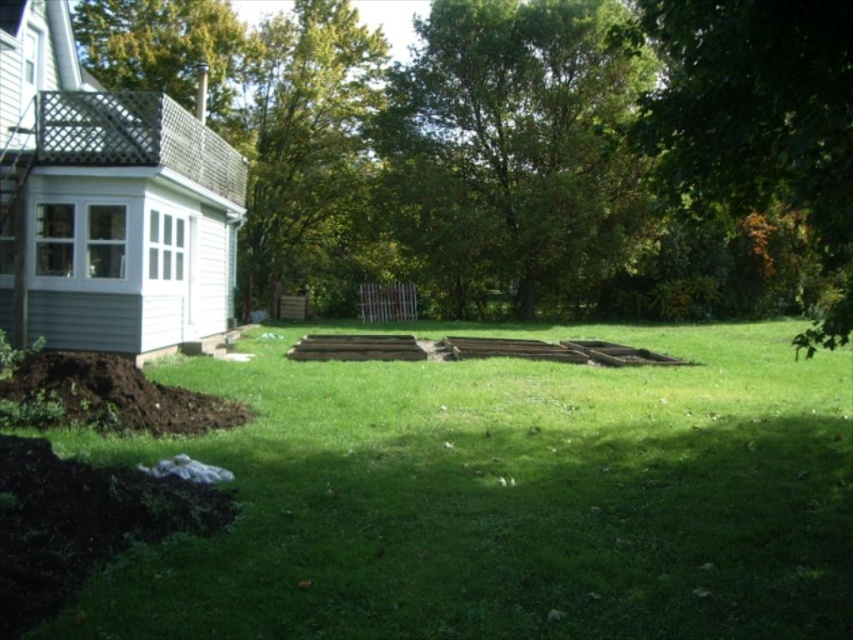
Question: Does green grass at center appear on the left side of green leafy tree at center?

Choices:
 (A) no
 (B) yes

Answer: (B)

Question: Which of the following is the closest to the observer?

Choices:
 (A) (793, 109)
 (B) (300, 136)

Answer: (A)

Question: Which object is positioned farthest from the green leafy tree at right?

Choices:
 (A) green leafy tree at upper left
 (B) green leafy tree at center
 (C) green grass at center

Answer: (A)

Question: Is green leafy tree at upper left positioned behind green leafy tree at right?

Choices:
 (A) yes
 (B) no

Answer: (A)

Question: Which object is positioned closest to the green leafy tree at upper left?

Choices:
 (A) green leafy tree at center
 (B) green grass at center

Answer: (A)

Question: Is green grass at center smaller than green leafy tree at center?

Choices:
 (A) yes
 (B) no

Answer: (A)